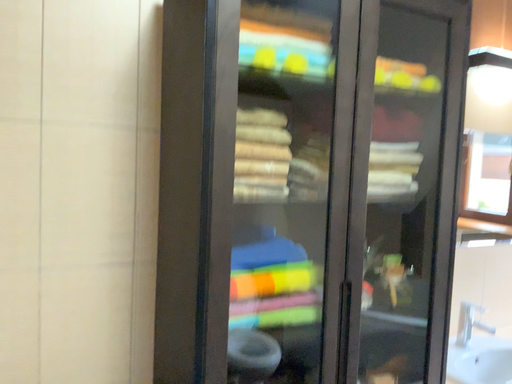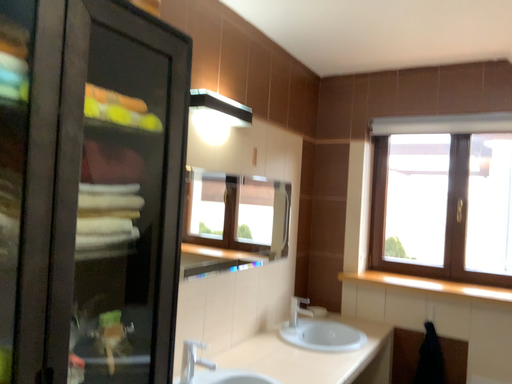
Question: Which way did the camera rotate in the video?

Choices:
 (A) rotated left
 (B) rotated right

Answer: (B)